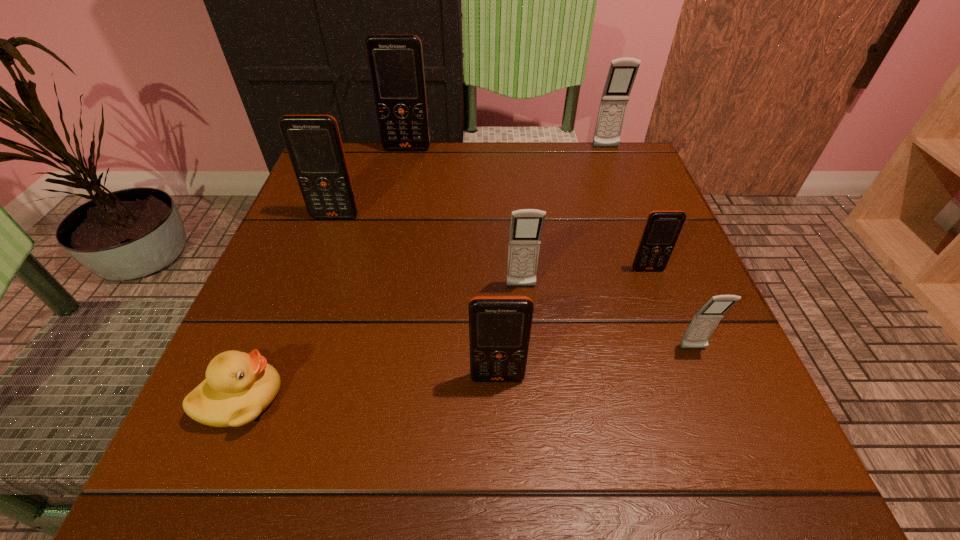
At what (x,y) coordinates should I click in order to perform the action: click on free spot between the yellow duckling and the leftmost gray cellular telephone. Please return your answer as a coordinate pair (x, y). Image resolution: width=960 pixels, height=540 pixels. Looking at the image, I should click on (381, 342).

At what (x,y) coordinates should I click in order to perform the action: click on free space between the fifth farthest cellular telephone and the second cellular telephone from left to right. Please return your answer as a coordinate pair (x, y). Looking at the image, I should click on (464, 218).

Image resolution: width=960 pixels, height=540 pixels. I want to click on free space between the fifth farthest cellular telephone and the shortest object, so click(381, 342).

This screenshot has height=540, width=960. I want to click on vacant area that lies between the second orange cellular telephone from right to left and the second biggest orange cellular telephone, so click(417, 297).

Locate an element on the screen. The image size is (960, 540). the seventh closest object to the leftmost orange cellular telephone is located at coordinates (703, 324).

What are the coordinates of `the closest object to the nearest orange cellular telephone` in the screenshot? It's located at (526, 227).

At what (x,y) coordinates should I click in order to perform the action: click on cellular telephone that is the sixth closest to the second smallest orange cellular telephone. Please return your answer as a coordinate pair (x, y). The image size is (960, 540). Looking at the image, I should click on click(622, 72).

Where is `cellular telephone that can be found as the fifth closest to the fourth farthest cellular telephone`? cellular telephone that can be found as the fifth closest to the fourth farthest cellular telephone is located at coordinates (313, 142).

Locate which orange cellular telephone ranks in proximity to the fourth farthest object. Please provide its 2D coordinates. Your answer should be formatted as a tuple, i.e. [(x, y)], where the tuple contains the x and y coordinates of a point satisfying the conditions above.

[(499, 326)]

I want to click on the third closest orange cellular telephone relative to the farthest gray cellular telephone, so click(x=313, y=142).